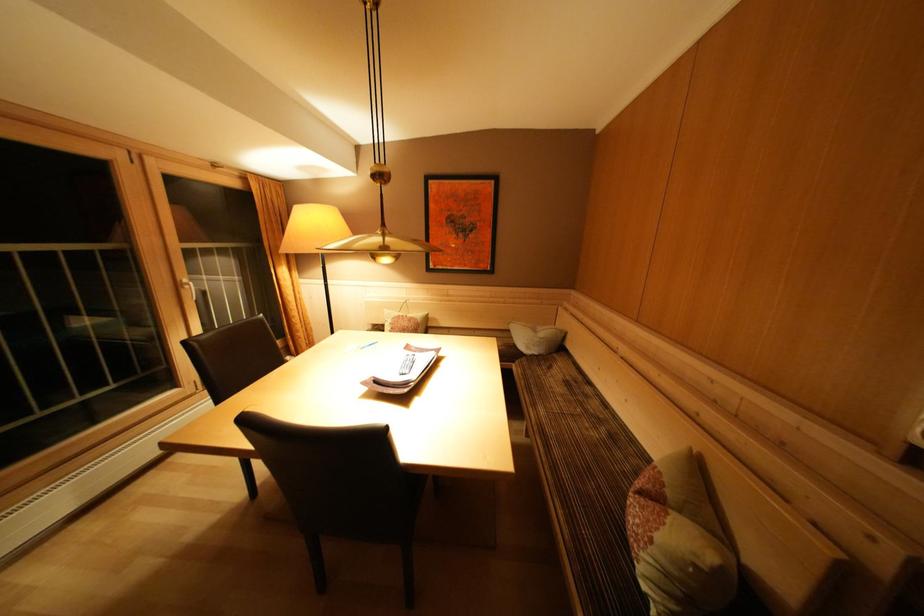
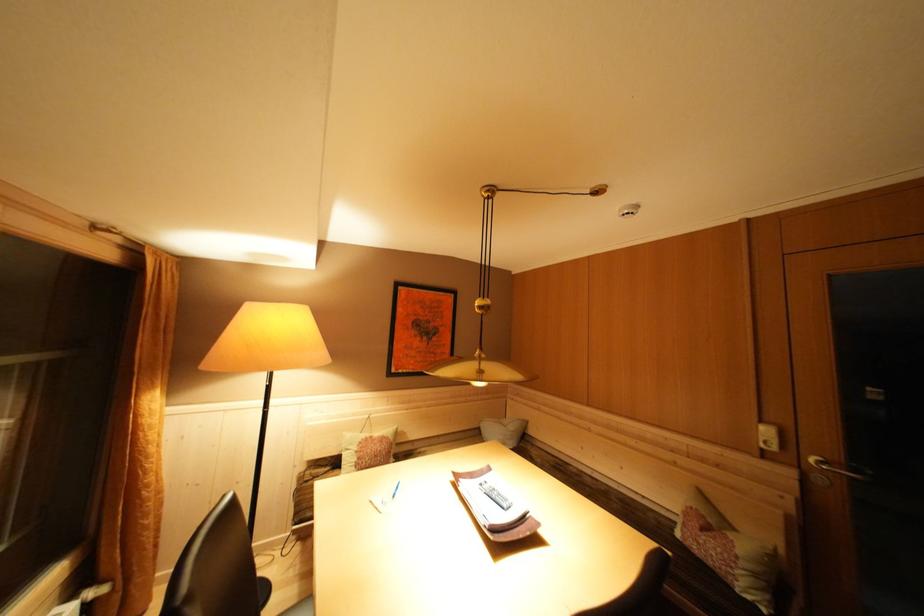
In the second image, find the point that corresponds to the point at 665,543 in the first image.

(746, 557)